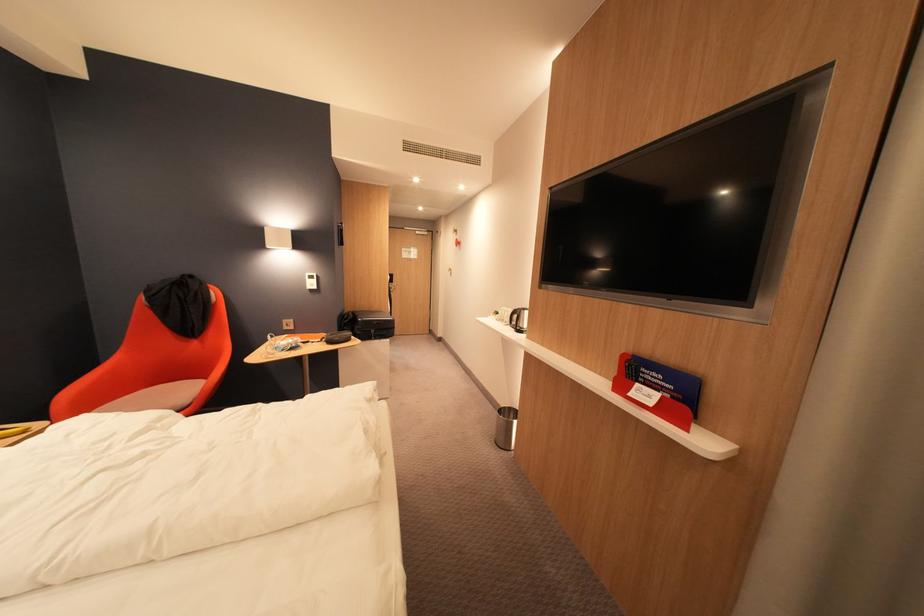
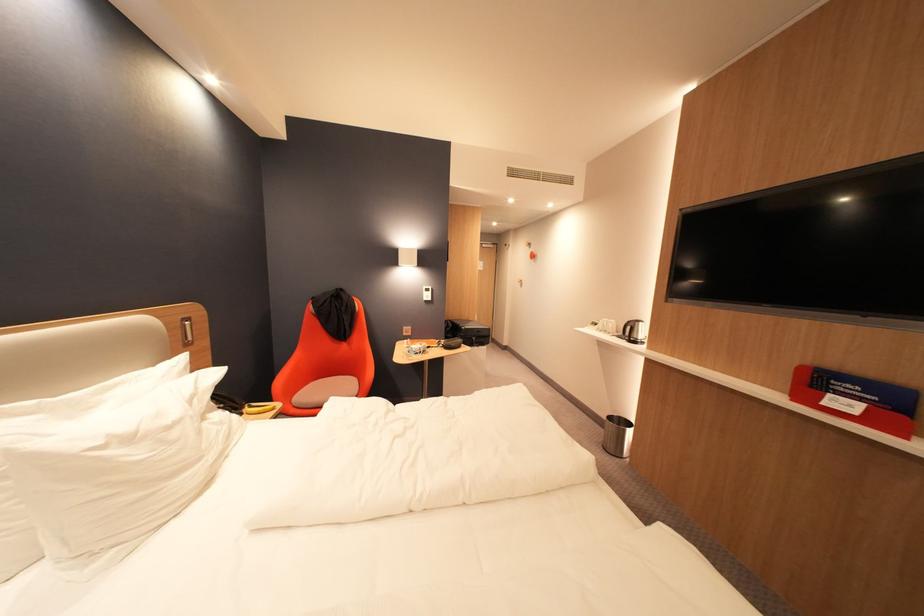
Question: The camera is either moving clockwise (left) or counter-clockwise (right) around the object. The first image is from the beginning of the video and the second image is from the end. Is the camera moving left or right when shooting the video?

Choices:
 (A) Left
 (B) Right

Answer: (B)